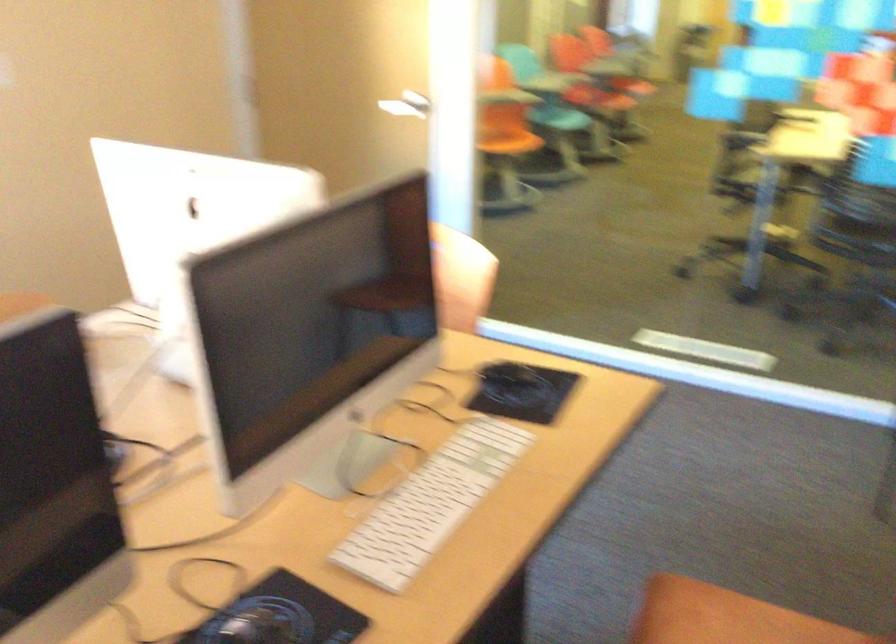
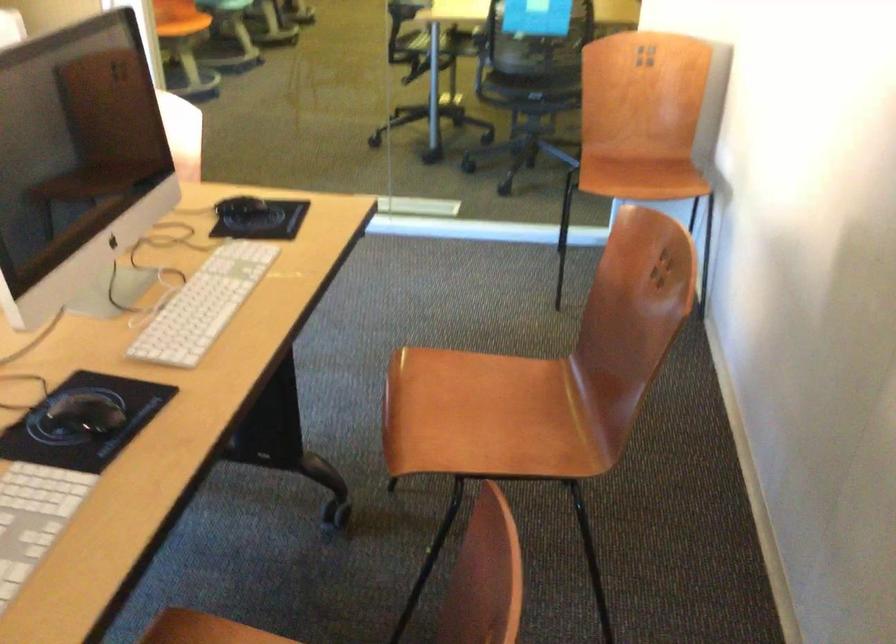
Question: Based on the continuous images, in which direction is the camera rotating? Reply with the corresponding letter.

Choices:
 (A) Left
 (B) Right
 (C) Up
 (D) Down

Answer: (B)